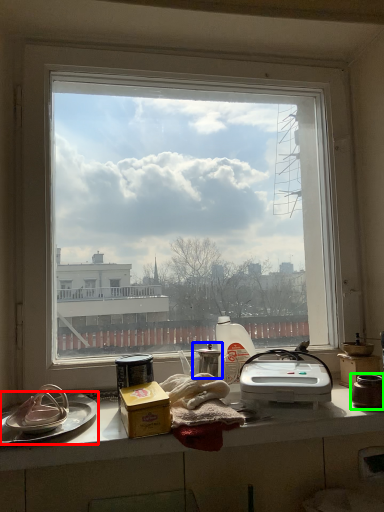
Question: Considering the real-world distances, which object is farthest from platter (highlighted by a red box)? appliance (highlighted by a blue box) or appliance (highlighted by a green box)?

Choices:
 (A) appliance
 (B) appliance

Answer: (B)